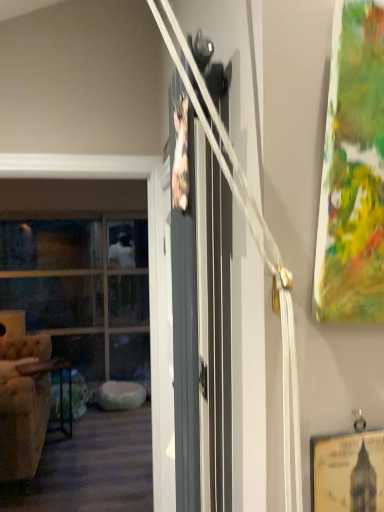
Question: From a real-world perspective, is matte gray barn door at center physically located above or below beige tufted armchair at left?

Choices:
 (A) above
 (B) below

Answer: (A)

Question: Is matte gray barn door at center in front of or behind beige tufted armchair at left in the image?

Choices:
 (A) behind
 (B) front

Answer: (B)

Question: Which is farther from the yellow paper picture frame at lower right?

Choices:
 (A) matte gray barn door at center
 (B) beige tufted armchair at left
 (C) clear glass window at left
 (D) metallic dark brown table at left

Answer: (C)

Question: Which is farther from the clear glass window at left?

Choices:
 (A) metallic dark brown table at left
 (B) beige tufted armchair at left
 (C) matte gray barn door at center
 (D) yellow paper picture frame at lower right

Answer: (D)